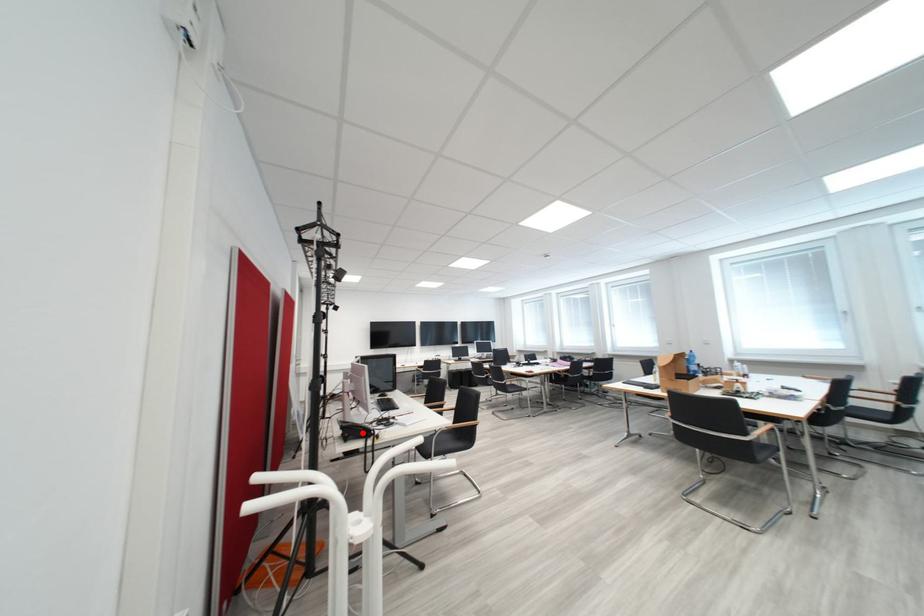
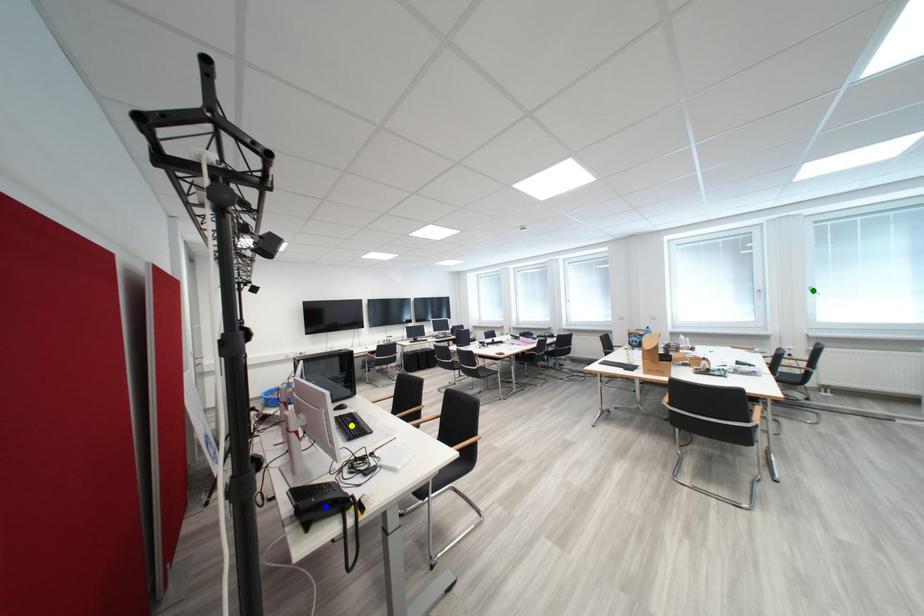
Question: I am providing you with two images of the same scene from different viewpoints. A red point is marked on the first image. You are given multiple points on the second image. Can you choose the point in image 2 that corresponds to the point in image 1?

Choices:
 (A) yellow point
 (B) green point
 (C) blue point

Answer: (C)